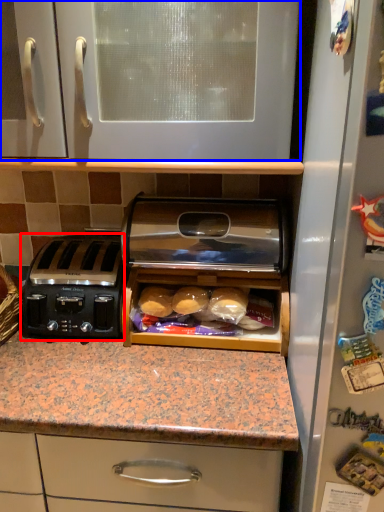
Question: Which object appears farthest to the camera in this image, toaster (highlighted by a red box) or cabinetry (highlighted by a blue box)?

Choices:
 (A) toaster
 (B) cabinetry

Answer: (A)